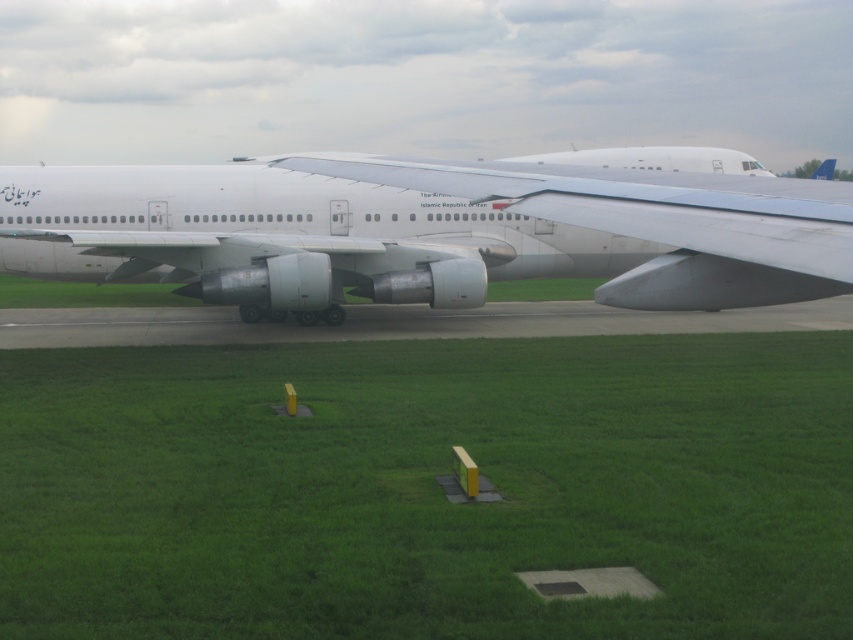
You are a maintenance worker inspecting the area around the airplane. You notice the green grass at center and the white matte tail at upper center. Which object is closer to the ground?

The green grass at center is closer to the ground because it is not as tall as the white matte tail at upper center.

You are standing on the airport tarmac and see the large commercial airplane parked there. There are two points marked on the plane, one at coordinates point [537,371] and the other at point [339,227]. Which point is closer to you?

Point [537,371] is closer to the camera than point [339,227].